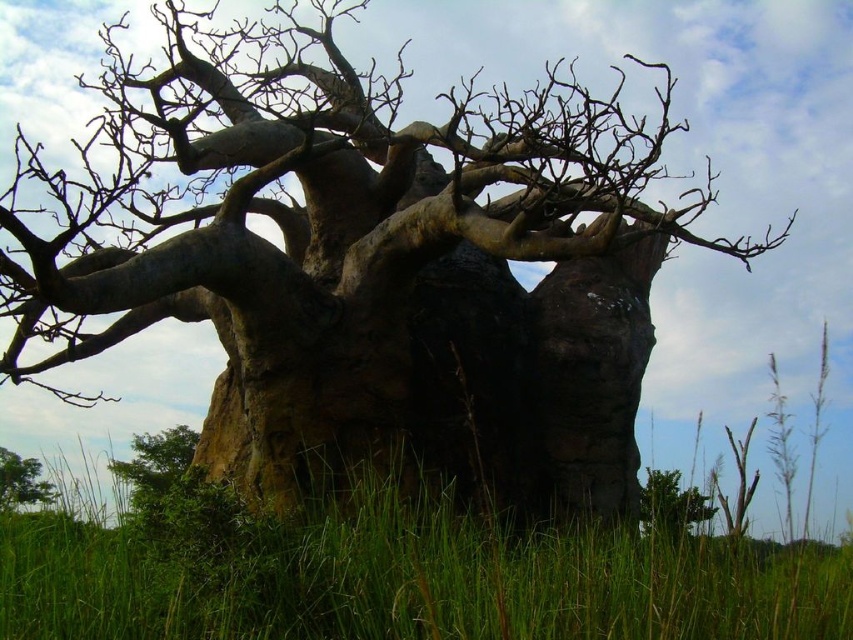
Question: Which point appears farthest from the camera in this image?

Choices:
 (A) (38, 467)
 (B) (181, 449)

Answer: (B)

Question: Which point is closer to the camera?

Choices:
 (A) (45, 492)
 (B) (138, 477)

Answer: (A)

Question: Considering the relative positions of green leafy bush at lower left and green rough tree at lower left in the image provided, where is green leafy bush at lower left located with respect to green rough tree at lower left?

Choices:
 (A) above
 (B) below

Answer: (A)

Question: Is green leafy bush at lower left above green rough tree at lower left?

Choices:
 (A) yes
 (B) no

Answer: (A)

Question: Is green leafy bush at lower left to the right of green rough tree at lower left from the viewer's perspective?

Choices:
 (A) no
 (B) yes

Answer: (B)